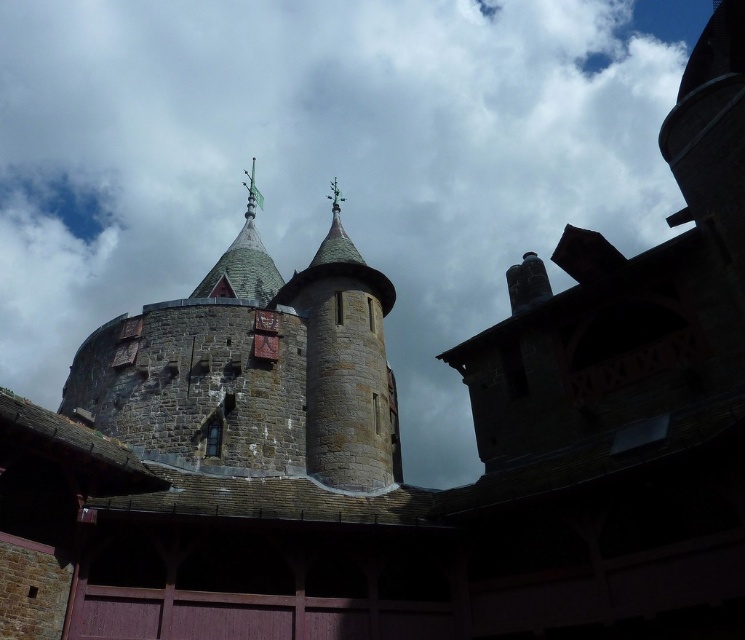
You are an architect examining the historic stone structure. You notice the white fluffy cloud at upper center and the stone tower at upper center in the image. Which object is closer to the viewer?

The white fluffy cloud at upper center is closer to the viewer because it is in front of the stone tower at upper center.

You are an architect designing a new flagpole for the stone tower at upper center. The flagpole needs to reach up to the white fluffy cloud at upper center. What is the minimum height the flagpole must be to reach the cloud?

The white fluffy cloud at upper center is 109.28 meters from the stone tower at upper center, so the flagpole must be at least 109.28 meters tall to reach it.

You are an architect examining the historic stone structure. You notice the white fluffy cloud at upper center and the stone tower at upper center. From your perspective, which object is positioned to the right?

The white fluffy cloud at upper center is to the right of the stone tower at upper center according to the description.